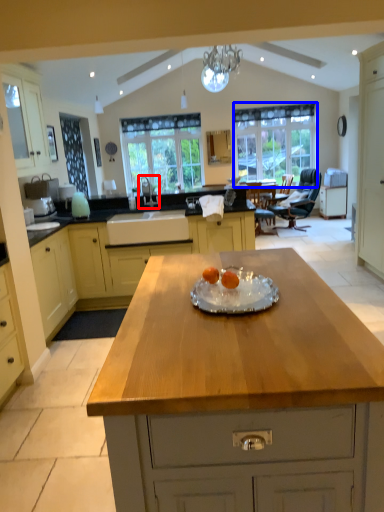
Question: Which object appears closest to the camera in this image, sink (highlighted by a red box) or window (highlighted by a blue box)?

Choices:
 (A) sink
 (B) window

Answer: (A)